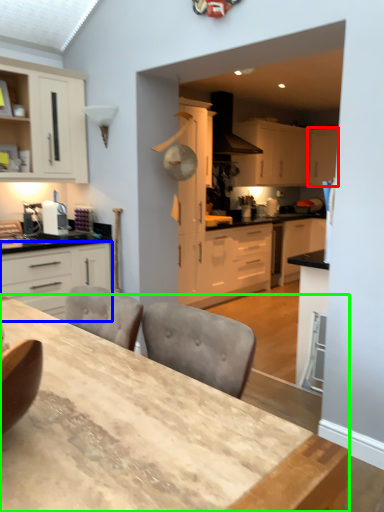
Question: Which object is positioned farthest from cabinetry (highlighted by a red box)? Select from cabinetry (highlighted by a blue box) and table (highlighted by a green box).

Choices:
 (A) cabinetry
 (B) table

Answer: (B)